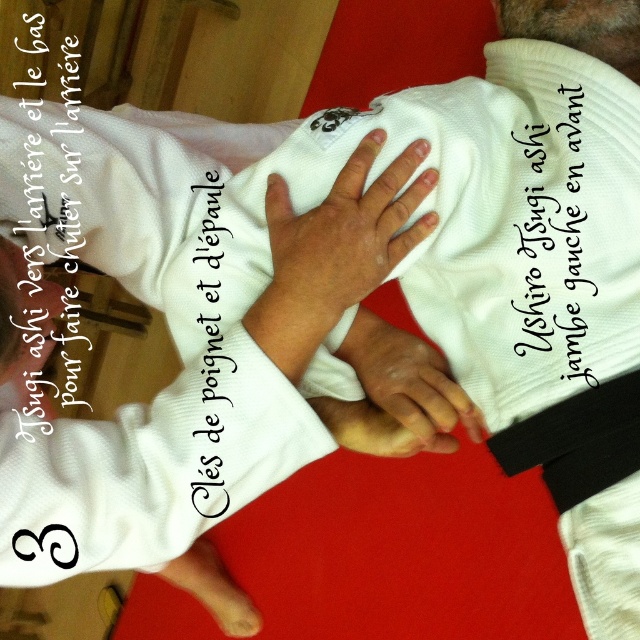
Question: Does black paper text at center have a larger size compared to white paper text at upper left?

Choices:
 (A) no
 (B) yes

Answer: (B)

Question: Which of the following is the farthest from the observer?

Choices:
 (A) black paper text at center
 (B) white ribbed robe at center
 (C) black fabric text at upper center
 (D) white paper text at upper left

Answer: (A)

Question: Which of the following is the closest to the observer?

Choices:
 (A) black fabric text at upper center
 (B) black fabric belt at lower right
 (C) white paper text at upper left

Answer: (C)

Question: Can you confirm if white ribbed robe at center is positioned above black fabric belt at lower right?

Choices:
 (A) yes
 (B) no

Answer: (A)

Question: Which point is closer to the camera taking this photo?

Choices:
 (A) (540, 317)
 (B) (22, 355)
 (C) (83, 157)

Answer: (B)

Question: Can you confirm if black paper text at center is positioned to the left of white paper text at upper left?

Choices:
 (A) no
 (B) yes

Answer: (A)